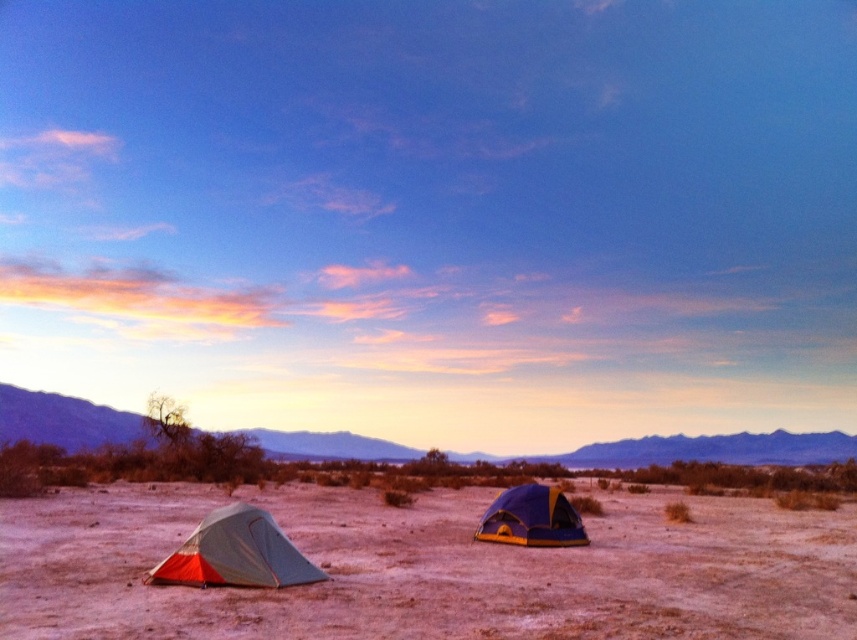
Is orange fabric tent at lower left above blue/yellow fabric tent at center?

Yes.

Image resolution: width=857 pixels, height=640 pixels. I want to click on orange fabric tent at lower left, so click(x=237, y=554).

Who is more forward, (x=268, y=598) or (x=489, y=532)?

Point (x=268, y=598)

Describe the element at coordinates (430, 570) in the screenshot. The image size is (857, 640). I see `gray sand at center` at that location.

Identify the location of gray sand at center. (430, 570).

Can you confirm if gray sand at center is smaller than orange fabric tent at lower left?

No, gray sand at center is not smaller than orange fabric tent at lower left.

Does point (66, 554) come closer to viewer compared to point (276, 576)?

No, (66, 554) is behind (276, 576).

You are a GUI agent. You are given a task and a screenshot of the screen. Output one action in this format:
    pyautogui.click(x=<x>, y=<y>)
    Task: Click on the gray sand at center
    
    Given the screenshot: What is the action you would take?
    pyautogui.click(x=430, y=570)

Locate an element on the screen. gray sand at center is located at coordinates pyautogui.click(x=430, y=570).